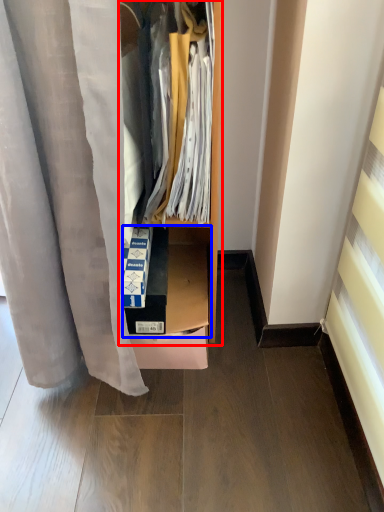
Question: Which object appears farthest to the camera in this image, dresser (highlighted by a red box) or shelf (highlighted by a blue box)?

Choices:
 (A) dresser
 (B) shelf

Answer: (B)